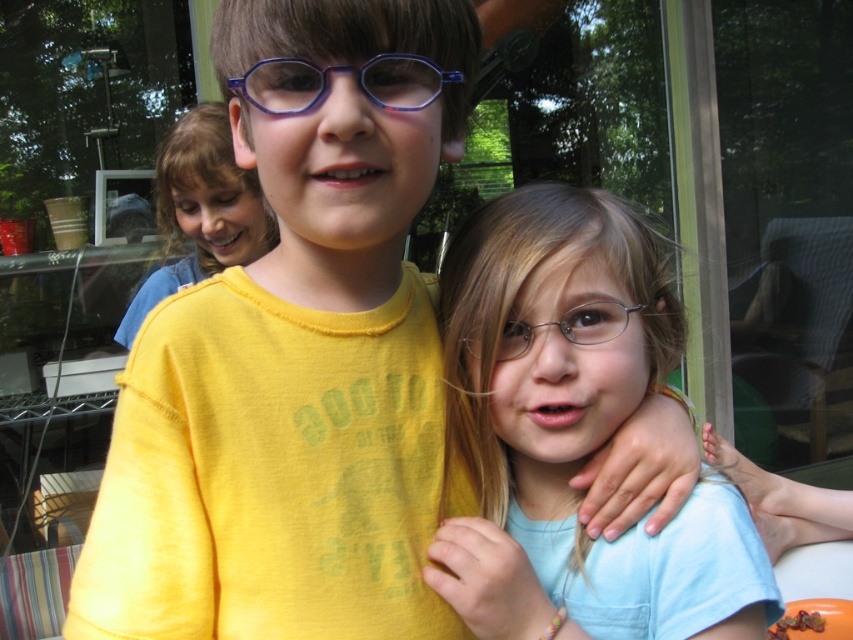
Question: Can you confirm if purple plastic glasses at center is bigger than clear plastic glasses at center?

Choices:
 (A) no
 (B) yes

Answer: (B)

Question: Which object is the farthest from the light blue t-shirt at center?

Choices:
 (A) purple plastic glasses at center
 (B) matte yellow shirt at upper center
 (C) clear plastic glasses at center

Answer: (B)

Question: Is matte yellow shirt at upper center to the left of purple plastic glasses at center from the viewer's perspective?

Choices:
 (A) yes
 (B) no

Answer: (A)

Question: Is matte yellow shirt at upper center in front of purple plastic glasses at center?

Choices:
 (A) yes
 (B) no

Answer: (B)

Question: Which object is the closest to the clear plastic glasses at center?

Choices:
 (A) matte yellow shirt at upper center
 (B) purple plastic glasses at center

Answer: (B)

Question: Which object is closer to the camera taking this photo?

Choices:
 (A) matte yellow shirt at upper center
 (B) clear plastic glasses at center

Answer: (B)